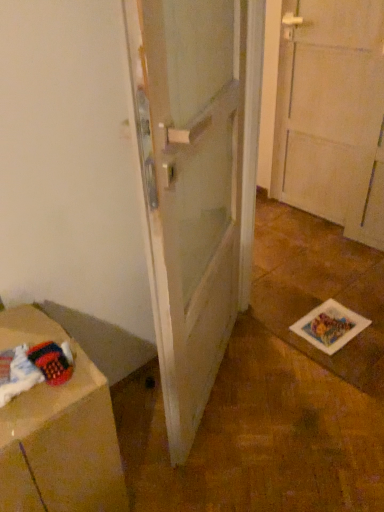
Where is `free spot above brown cardboard at lower left (from a real-world perspective)`? Image resolution: width=384 pixels, height=512 pixels. free spot above brown cardboard at lower left (from a real-world perspective) is located at coordinates (27, 355).